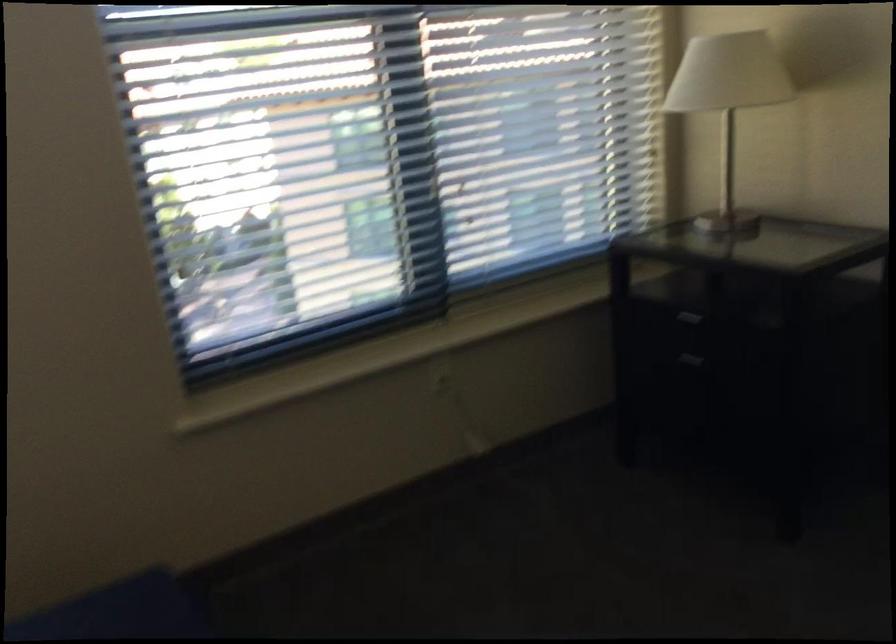
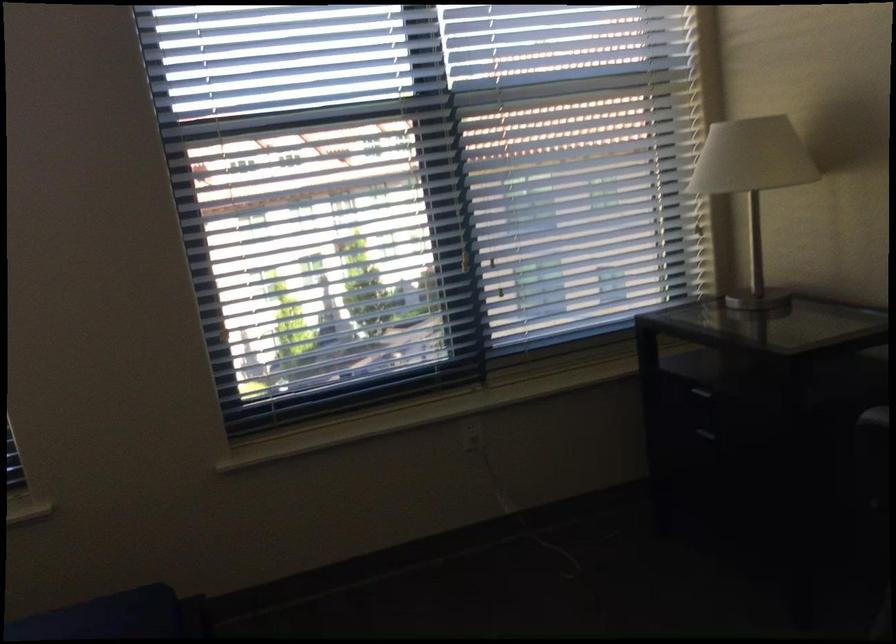
Find the pixel in the second image that matches pixel 441 373 in the first image.

(471, 433)